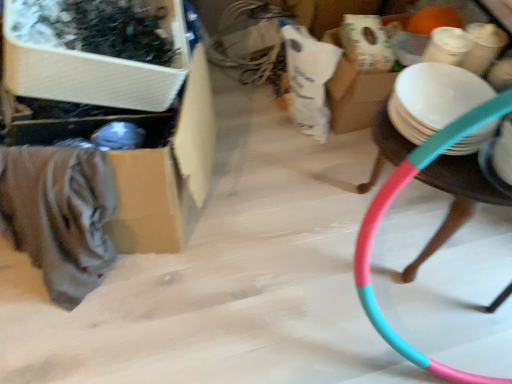
Question: Considering the positions of pink plastic hoop at right and white matte plate at right in the image, is pink plastic hoop at right wider or thinner than white matte plate at right?

Choices:
 (A) thin
 (B) wide

Answer: (B)

Question: Is pink plastic hoop at right bigger or smaller than white matte plate at right?

Choices:
 (A) small
 (B) big

Answer: (B)

Question: Considering the real-world distances, which object is closest to the wooden storage box at upper left, acting as the first storage box starting from the front?

Choices:
 (A) white matte plate at right
 (B) cardboard box at left, the first storage box in the back-to-front sequence
 (C) pink plastic hoop at right

Answer: (B)

Question: Which of these objects is positioned farthest from the wooden storage box at upper left, acting as the first storage box starting from the front?

Choices:
 (A) white matte plate at right
 (B) pink plastic hoop at right
 (C) cardboard box at left, which appears as the second storage box when viewed from the front

Answer: (A)